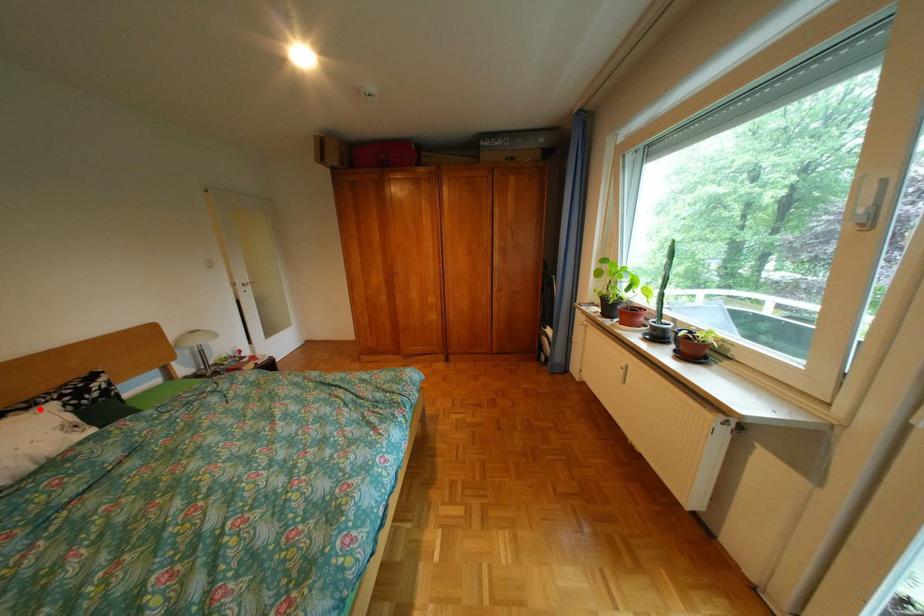
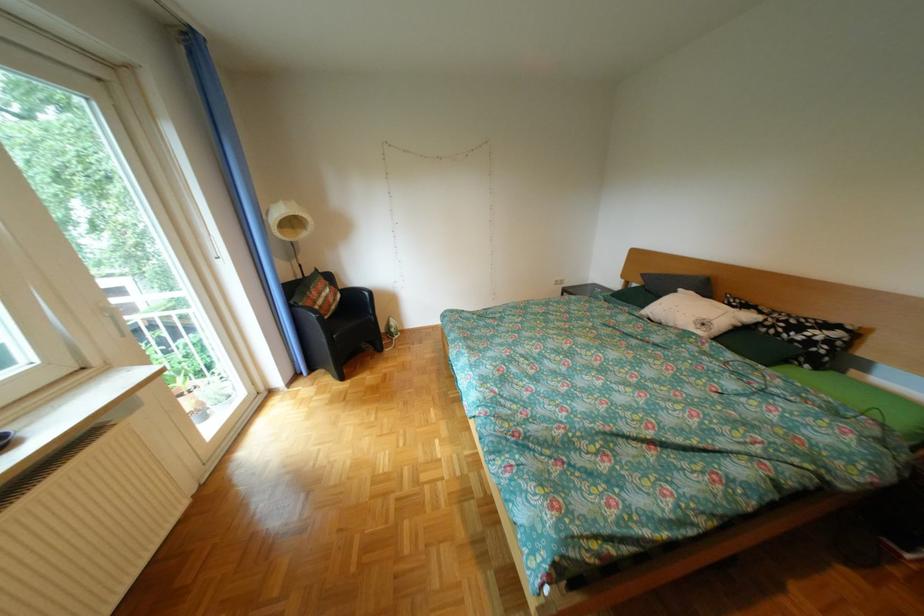
In the second image, find the point that corresponds to the highlighted location in the first image.

(775, 313)